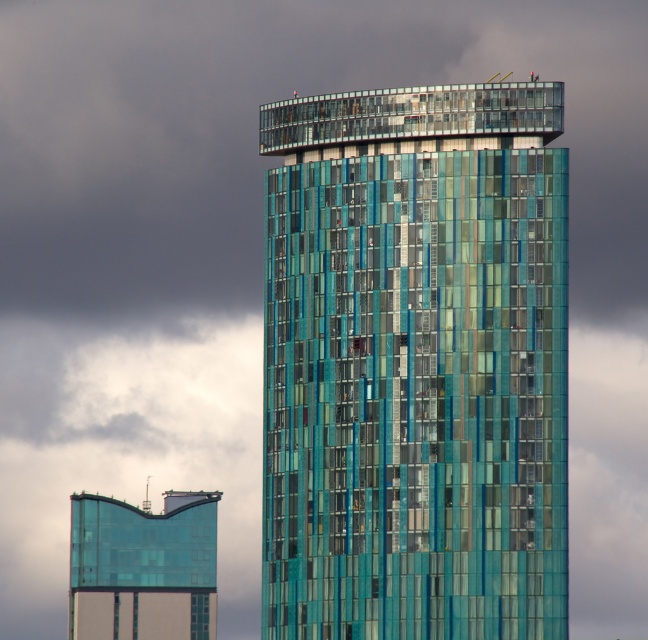
Is teal glass tower at center taller than transparent glass tower at lower left?

Indeed, teal glass tower at center has a greater height compared to transparent glass tower at lower left.

Who is higher up, teal glass tower at center or transparent glass tower at lower left?

Positioned higher is teal glass tower at center.

Does point (338, 365) come behind point (165, 593)?

No, (338, 365) is in front of (165, 593).

Locate an element on the screen. This screenshot has width=648, height=640. teal glass tower at center is located at coordinates (415, 364).